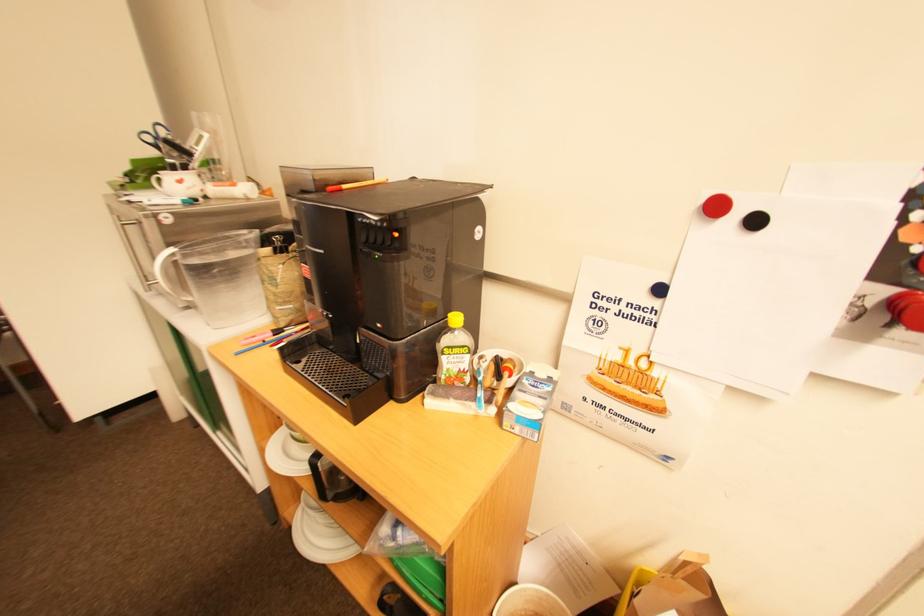
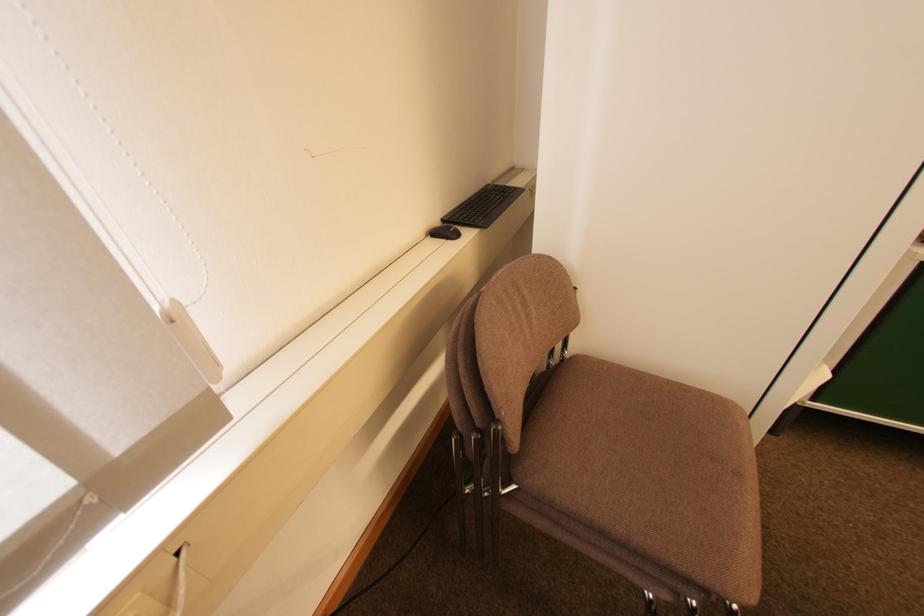
Question: The images are taken continuously from a first-person perspective. In which direction are you moving?

Choices:
 (A) Left
 (B) Right
 (C) Forward
 (D) Backward

Answer: (A)